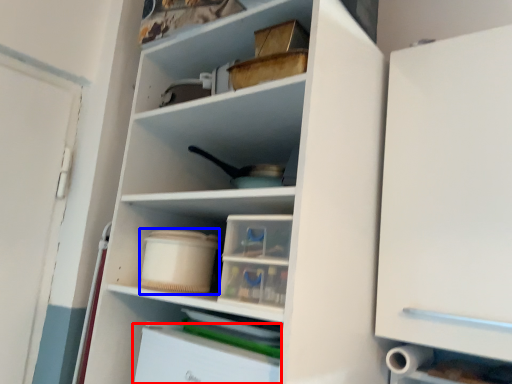
Question: Which of the following is the farthest to the observer, cabinetry (highlighted by a red box) or storage box (highlighted by a blue box)?

Choices:
 (A) cabinetry
 (B) storage box

Answer: (B)